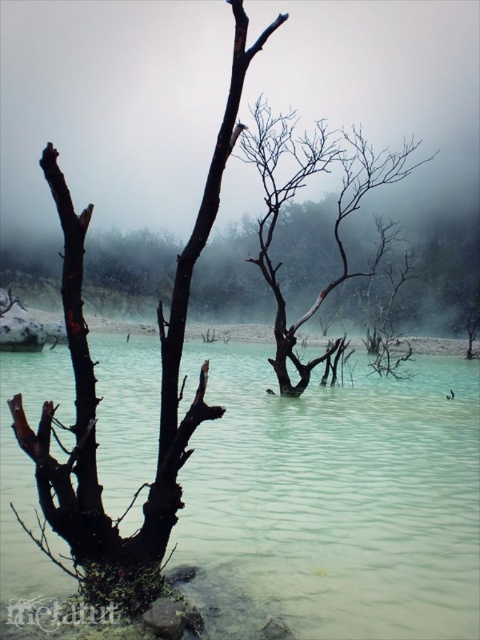
Between green translucent water at center and dark brown bark tree at left, which one has more height?

Standing taller between the two is dark brown bark tree at left.

Can you confirm if green translucent water at center is shorter than dark brown bark tree at left?

Yes, green translucent water at center is shorter than dark brown bark tree at left.

Is point (354, 451) behind point (181, 458)?

Yes, point (354, 451) is behind point (181, 458).

You are a GUI agent. You are given a task and a screenshot of the screen. Output one action in this format:
    pyautogui.click(x=<x>, y=<y>)
    Task: Click on the green translucent water at center
    
    Given the screenshot: What is the action you would take?
    pyautogui.click(x=334, y=499)

Is dark brown bark tree at left positioned in front of charcoal matte tree at center?

Yes, it is.

Can you confirm if dark brown bark tree at left is positioned below charcoal matte tree at center?

Correct, dark brown bark tree at left is located below charcoal matte tree at center.

Describe the element at coordinates (98, 397) in the screenshot. I see `dark brown bark tree at left` at that location.

Identify the location of dark brown bark tree at left. This screenshot has height=640, width=480. (98, 397).

Is green translucent water at center positioned in front of charcoal matte tree at center?

That is True.

At what (x,y) coordinates should I click in order to perform the action: click on green translucent water at center. Please return your answer as a coordinate pair (x, y). The width and height of the screenshot is (480, 640). Looking at the image, I should click on (334, 499).

Is point (344, 412) closer to viewer compared to point (282, 204)?

Yes, point (344, 412) is in front of point (282, 204).

Locate an element on the screen. The height and width of the screenshot is (640, 480). green translucent water at center is located at coordinates (334, 499).